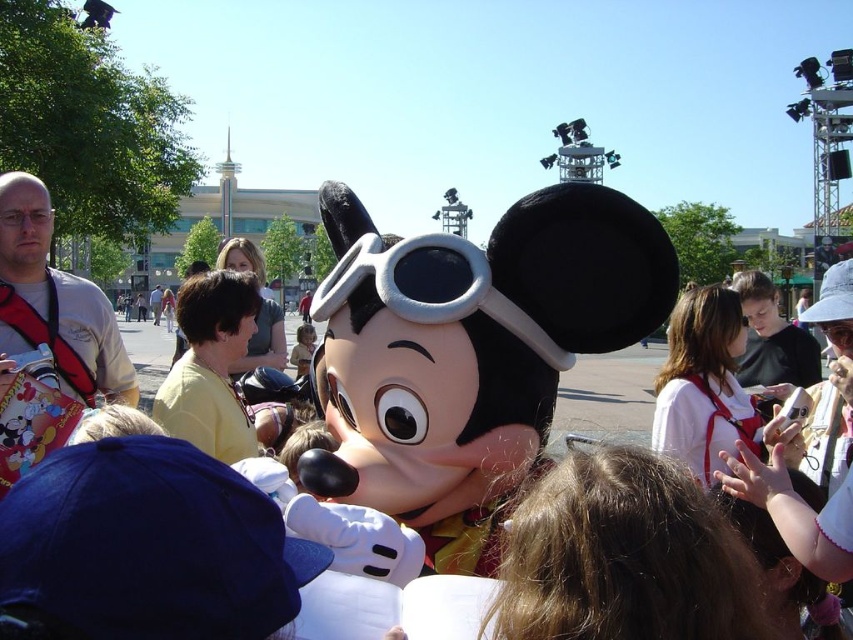
You are standing at the event and want to take a photo of both the Mickey Mouse character and the child holding the white object. The Mickey Mouse character is at point [476,541] and the child is at point [328,285]. Which of these two points is closer to you so that you can focus your camera properly?

Point [476,541] is closer to the camera than point [328,285], so you should focus on that point first to ensure both subjects are in clear view.

You are a parent trying to take a photo of your child with the matte black plush at center and the soft gray fabric goggles at center. To ensure both objects are in the frame, which object should you position closer to the camera?

The matte black plush at center is taller than the soft gray fabric goggles at center, so you should position the soft gray fabric goggles at center closer to the camera to ensure both are in the frame.

You are a photographer positioned at the front of the crowd. You want to take a photo of the matte black plush at center and the soft gray fabric goggles at center. Which object will appear larger in your photo?

The matte black plush at center will appear larger in the photo because it is closer to the viewer than the soft gray fabric goggles at center.